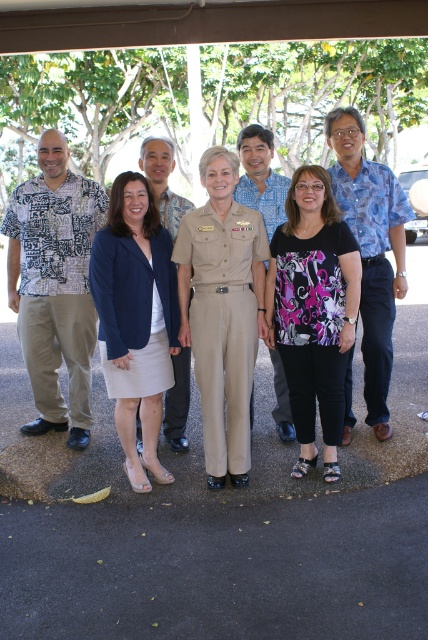
You are a photographer trying to capture a group photo of the khaki uniform pants at center and the blue printed shirt at right. Since you want to ensure both subjects are in focus, you need to know which one is shorter. Which one is shorter?

The khaki uniform pants at center has a lesser height compared to the blue printed shirt at right, so the khaki uniform pants at center is shorter.

You are standing at the front of the scene and want to hand a document to both the khaki uniform pants at center and the blue printed shirt at right. Which person should you approach first to ensure you can reach them without moving further forward?

You should approach the khaki uniform pants at center first because it is closer to the viewer than the blue printed shirt at right, so you can reach them without moving further forward.